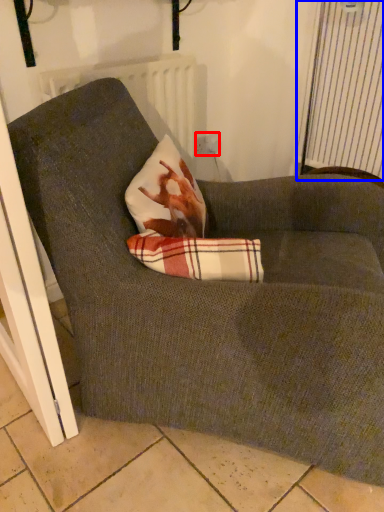
Question: Which object is further to the camera taking this photo, electric outlet (highlighted by a red box) or curtain (highlighted by a blue box)?

Choices:
 (A) electric outlet
 (B) curtain

Answer: (A)